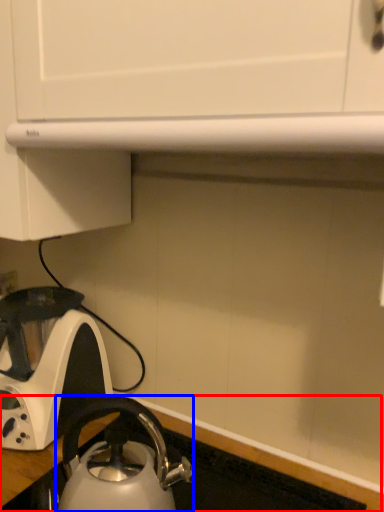
Question: Among these objects, which one is farthest to the camera, counter top (highlighted by a red box) or kettle (highlighted by a blue box)?

Choices:
 (A) counter top
 (B) kettle

Answer: (B)